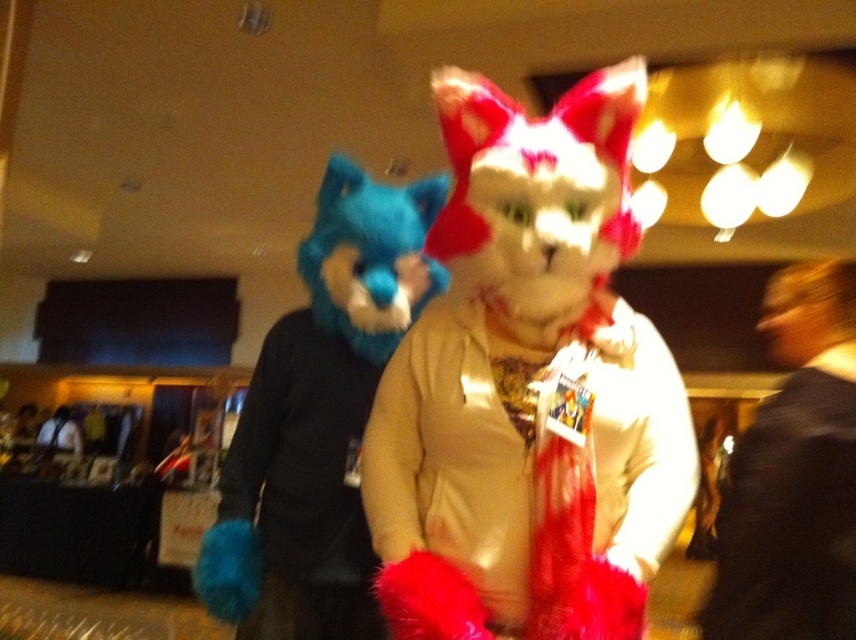
Does fuzzy blue glove at left come behind black fuzzy coat at right?

Yes, fuzzy blue glove at left is further from the viewer.

Is fuzzy blue glove at left smaller than black fuzzy coat at right?

Actually, fuzzy blue glove at left might be larger than black fuzzy coat at right.

Which is in front, point (302, 353) or point (819, 611)?

Point (819, 611) is more forward.

This screenshot has height=640, width=856. What are the coordinates of `fuzzy blue glove at left` in the screenshot? It's located at (294, 496).

Is fuzzy white scarf at center to the right of fuzzy blue glove at left from the viewer's perspective?

Correct, you'll find fuzzy white scarf at center to the right of fuzzy blue glove at left.

Is point (477, 614) in front of point (370, 600)?

Yes, it is in front of point (370, 600).

Is point (449, 598) positioned behind point (284, 488)?

No, it is not.

The width and height of the screenshot is (856, 640). In order to click on fuzzy white scarf at center in this screenshot , I will do `click(525, 476)`.

Describe the element at coordinates (525, 476) in the screenshot. I see `fuzzy white scarf at center` at that location.

The height and width of the screenshot is (640, 856). Identify the location of fuzzy white scarf at center. (525, 476).

Is point (409, 604) farther from viewer compared to point (805, 486)?

That is False.

Locate an element on the screen. Image resolution: width=856 pixels, height=640 pixels. fuzzy white scarf at center is located at coordinates (525, 476).